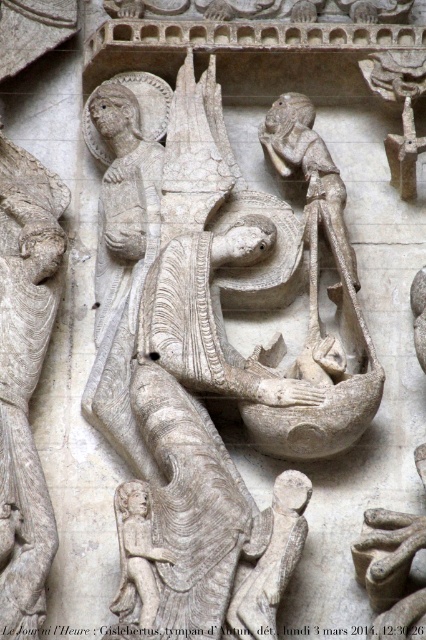
Question: Considering the relative positions of stone statue at center and white stone angel at upper left in the image provided, where is stone statue at center located with respect to white stone angel at upper left?

Choices:
 (A) below
 (B) above

Answer: (B)

Question: Can you confirm if stone statue at center is smaller than white stone angel at upper left?

Choices:
 (A) no
 (B) yes

Answer: (A)

Question: Is stone statue at center smaller than white stone angel at upper left?

Choices:
 (A) yes
 (B) no

Answer: (B)